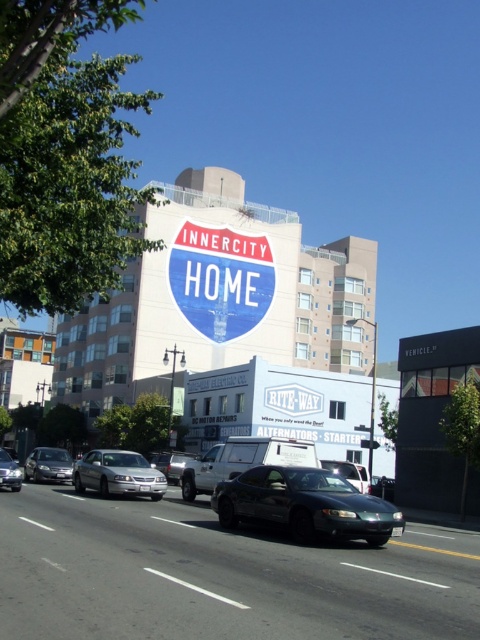
You are a pedestrian standing on the sidewalk and want to cross the street. You see the blue glossy sign at center and the metallic silver truck at center. Which one is higher from the ground?

The blue glossy sign at center is above metallic silver truck at center, so the blue glossy sign at center is higher from the ground.

You are a pedestrian standing on the sidewalk and see the shiny dark green car at center and the satin silver sedan at center driving towards you. Which car appears closer to you?

The shiny dark green car at center appears closer because it has a smaller size compared to the satin silver sedan at center, indicating it is farther away.

You are standing on the sidewalk and see two points on the road ahead. The first point is at coordinates point (119, 468) and the second is at point (21, 468). Which point is closer to you?

Point (119, 468) is closer to the viewer than point (21, 468).